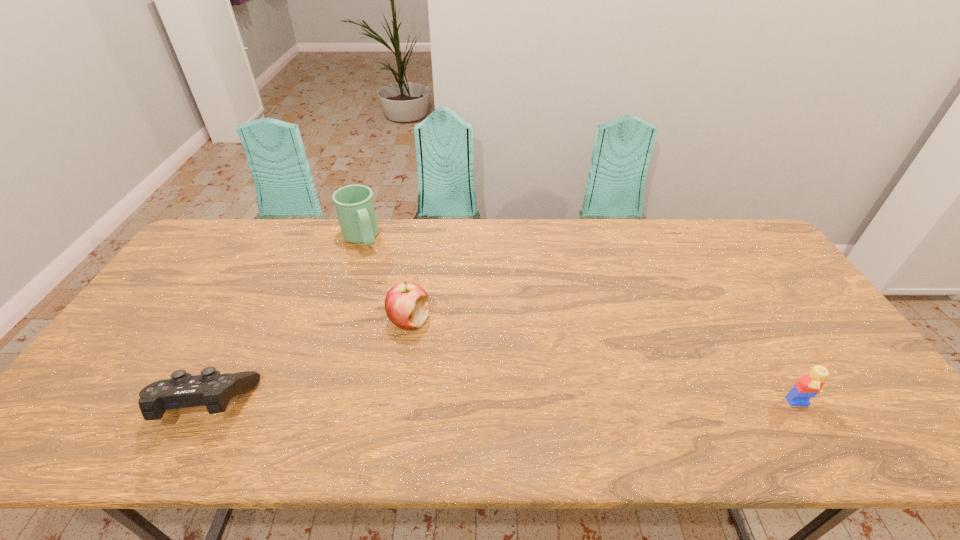
Locate an element on the screen. The image size is (960, 540). blank area located 0.130m on the bitten side of the third nearest object is located at coordinates 423,374.

I want to click on blank area located 0.230m on the side of the second object from left to right with the handle, so click(391, 295).

Where is `blank space located on the side of the second object from left to right with the handle`? The height and width of the screenshot is (540, 960). blank space located on the side of the second object from left to right with the handle is located at coordinates (384, 283).

I want to click on free region located 0.130m on the side of the second object from left to right with the handle, so click(x=380, y=275).

Locate an element on the screen. object situated at the far edge is located at coordinates (354, 204).

Image resolution: width=960 pixels, height=540 pixels. I want to click on control positioned at the near edge, so click(211, 389).

Image resolution: width=960 pixels, height=540 pixels. What are the coordinates of `Lego that is at the near edge` in the screenshot? It's located at (809, 385).

I want to click on free region at the far edge, so click(x=447, y=220).

In the image, there is a desktop. Identify the location of vacant space at the near edge. (722, 397).

Locate an element on the screen. vacant space at the right edge of the desktop is located at coordinates (802, 329).